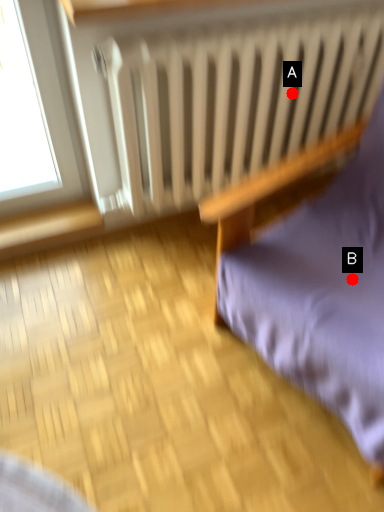
Question: Two points are circled on the image, labeled by A and B beside each circle. Which point is closer to the camera?

Choices:
 (A) A is closer
 (B) B is closer

Answer: (B)